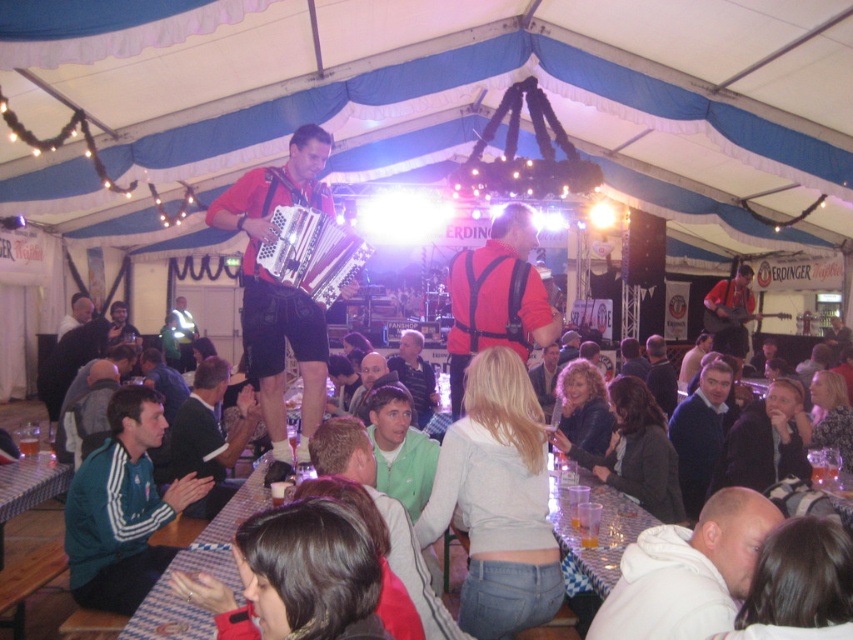
Question: Does dark blue sweater at center have a lesser width compared to green fabric shirt at center?

Choices:
 (A) yes
 (B) no

Answer: (B)

Question: Does dark blue sweater at center appear on the left side of orange fabric guitar at center?

Choices:
 (A) no
 (B) yes

Answer: (B)

Question: Which of the following is the farthest from the observer?

Choices:
 (A) matte red shirt at center
 (B) green fabric jacket at lower left

Answer: (A)

Question: Can you confirm if green matte jacket at center is positioned above orange fabric guitar at center?

Choices:
 (A) yes
 (B) no

Answer: (B)

Question: Which object is farther from the camera taking this photo?

Choices:
 (A) green matte jacket at center
 (B) green fabric jacket at center

Answer: (B)

Question: Which point is farther from the camera taking this photo?

Choices:
 (A) (463, 362)
 (B) (379, 371)
 (C) (401, 353)

Answer: (C)